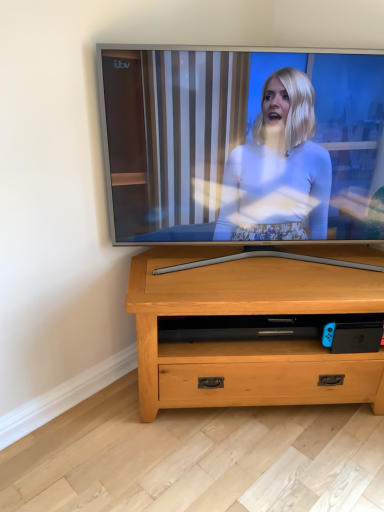
Question: Considering the positions of light wood chest of drawers at center and silver glossy tv at center in the image, is light wood chest of drawers at center bigger or smaller than silver glossy tv at center?

Choices:
 (A) big
 (B) small

Answer: (A)

Question: From the image's perspective, relative to silver glossy tv at center, is light wood chest of drawers at center above or below?

Choices:
 (A) above
 (B) below

Answer: (B)

Question: Is light wood chest of drawers at center inside the boundaries of silver glossy tv at center, or outside?

Choices:
 (A) outside
 (B) inside

Answer: (A)

Question: From a real-world perspective, relative to light wood chest of drawers at center, is silver glossy tv at center vertically above or below?

Choices:
 (A) above
 (B) below

Answer: (A)

Question: From the image's perspective, relative to light wood chest of drawers at center, is silver glossy tv at center above or below?

Choices:
 (A) above
 (B) below

Answer: (A)

Question: Is point (339, 222) closer or farther from the camera than point (167, 352)?

Choices:
 (A) farther
 (B) closer

Answer: (A)

Question: Based on their sizes in the image, would you say silver glossy tv at center is bigger or smaller than light wood chest of drawers at center?

Choices:
 (A) big
 (B) small

Answer: (B)